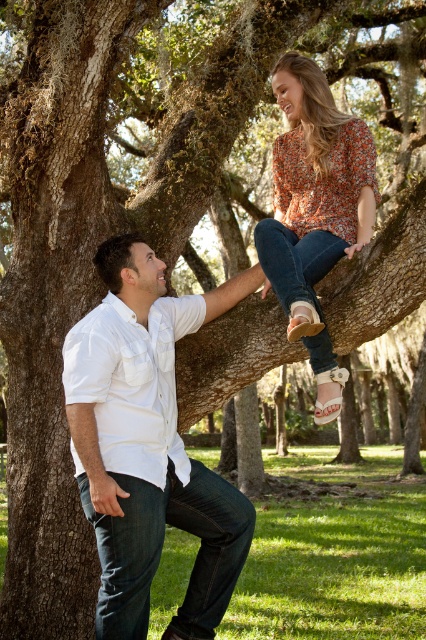
Question: Can you confirm if white cotton shirt at left is bigger than floral print blouse at upper center?

Choices:
 (A) yes
 (B) no

Answer: (A)

Question: Which point is farther to the camera?

Choices:
 (A) (290, 209)
 (B) (155, 285)

Answer: (A)

Question: Does white cotton shirt at left have a lesser width compared to floral print blouse at upper center?

Choices:
 (A) no
 (B) yes

Answer: (A)

Question: Is white cotton shirt at left thinner than floral print blouse at upper center?

Choices:
 (A) yes
 (B) no

Answer: (B)